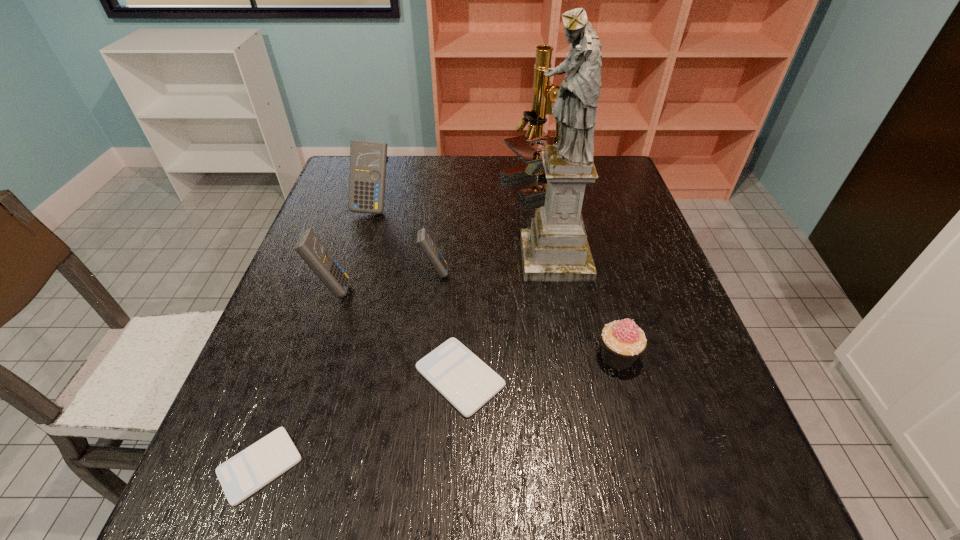
The image size is (960, 540). Find the location of `vacant region that satisfies the following two spatial constraints: 1. on the front-facing side of the cupcake; 2. on the left side of the second smallest blue calculator`. vacant region that satisfies the following two spatial constraints: 1. on the front-facing side of the cupcake; 2. on the left side of the second smallest blue calculator is located at coordinates (309, 356).

Locate an element on the screen. vacant region that satisfies the following two spatial constraints: 1. on the back side of the farther white calculator; 2. on the front-facing side of the rightmost blue calculator is located at coordinates (464, 272).